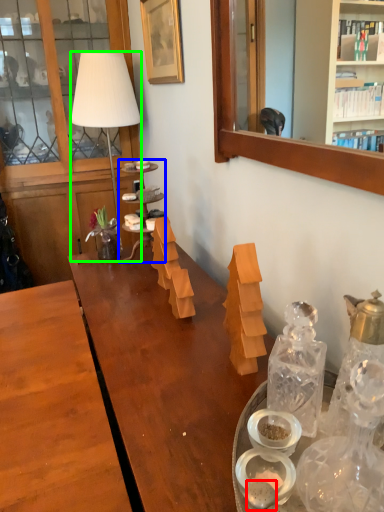
Question: Which is nearer to the food (highlighted by a red box)? shelf (highlighted by a blue box) or lamp (highlighted by a green box).

Choices:
 (A) shelf
 (B) lamp

Answer: (A)